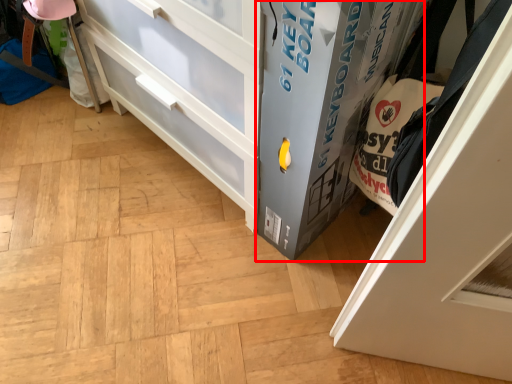
Question: From the image's perspective, what is the correct spatial positioning of cabinetry (annotated by the red box) in reference to door?

Choices:
 (A) above
 (B) below

Answer: (A)